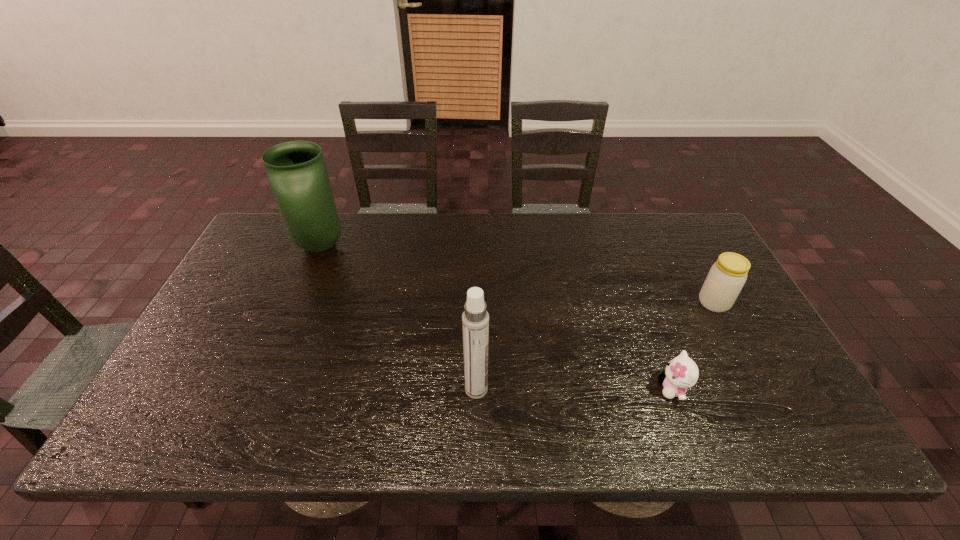
Find the location of a particular element. Image resolution: width=960 pixels, height=540 pixels. vacant position located on the front-facing side of the second object from right to left is located at coordinates (568, 389).

Locate an element on the screen. free space located 0.330m on the front-facing side of the second object from right to left is located at coordinates (516, 389).

I want to click on free point located on the front-facing side of the second object from right to left, so click(615, 389).

The image size is (960, 540). What are the coordinates of `object at the far edge` in the screenshot? It's located at (297, 174).

This screenshot has width=960, height=540. In order to click on object situated at the left edge in this screenshot , I will do `click(297, 174)`.

Locate an element on the screen. The height and width of the screenshot is (540, 960). object present at the right edge is located at coordinates (727, 276).

At what (x,y) coordinates should I click in order to perform the action: click on object that is at the far left corner. Please return your answer as a coordinate pair (x, y). The height and width of the screenshot is (540, 960). Looking at the image, I should click on (297, 174).

Where is `free point at the far edge`? This screenshot has height=540, width=960. free point at the far edge is located at coordinates (541, 233).

Image resolution: width=960 pixels, height=540 pixels. In the image, there is a desktop. In order to click on vacant area at the near edge in this screenshot , I will do `click(267, 411)`.

In the image, there is a desktop. Identify the location of vacant space at the left edge. (267, 267).